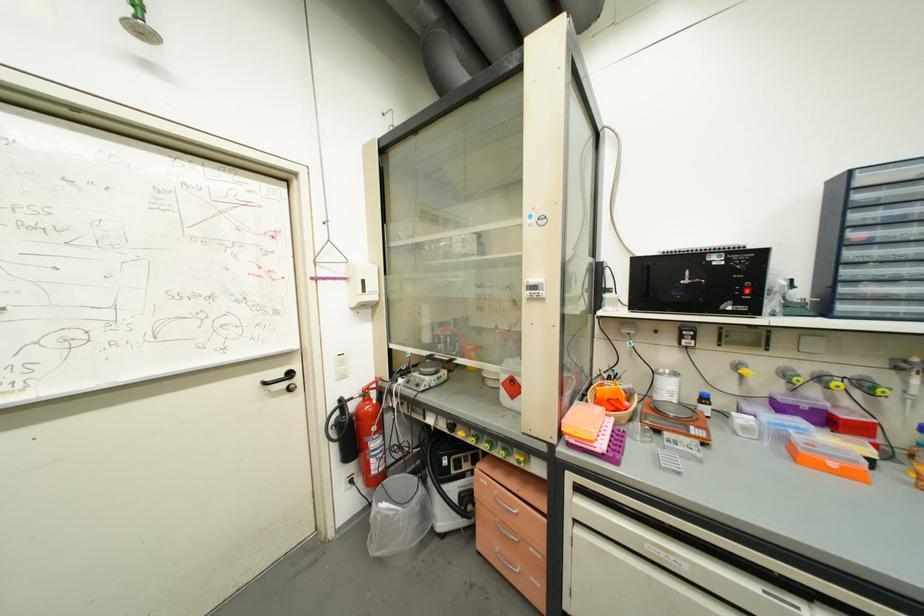
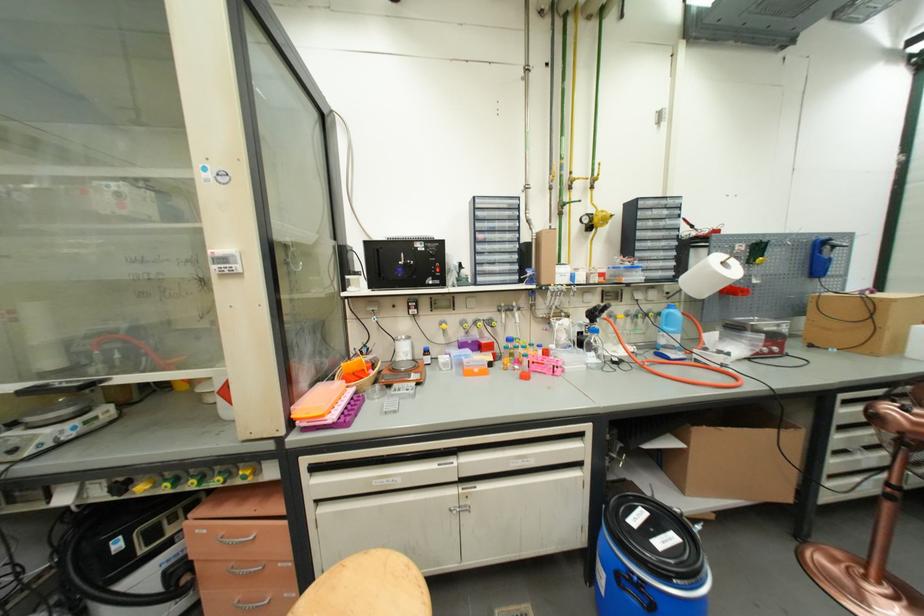
Question: The camera is either moving clockwise (left) or counter-clockwise (right) around the object. The first image is from the beginning of the video and the second image is from the end. Is the camera moving left or right when shooting the video?

Choices:
 (A) Left
 (B) Right

Answer: (A)